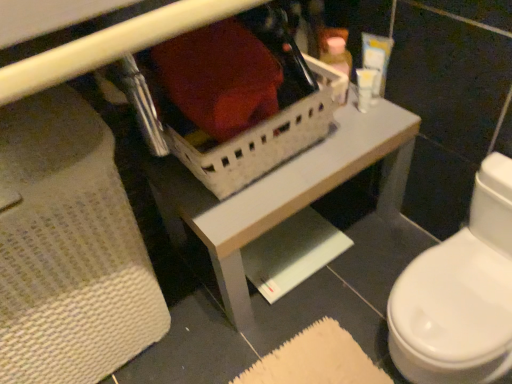
You are a GUI agent. You are given a task and a screenshot of the screen. Output one action in this format:
    pyautogui.click(x=<x>, y=<y>)
    Task: Click on the white plastic container at upper right, the 2th toiletry when ordered from right to left
    
    Given the screenshot: What is the action you would take?
    pyautogui.click(x=365, y=88)

At what (x,y) coordinates should I click in order to perform the action: click on white plastic container at upper center, marked as the 1th toiletry in a left-to-right arrangement. Please return your answer as a coordinate pair (x, y). The width and height of the screenshot is (512, 384). Looking at the image, I should click on (337, 55).

From the image's perspective, does white plastic container at upper right, the 2th toiletry when ordered from right to left, appear lower than white plastic basket at center?

No.

Is white plastic container at upper right, the 2th toiletry when ordered from right to left, thinner than white plastic basket at center?

Yes, white plastic container at upper right, the 2th toiletry when ordered from right to left, is thinner than white plastic basket at center.

Considering the sizes of objects white plastic container at upper right, the 2th toiletry when ordered from right to left, and white plastic basket at center in the image provided, who is bigger, white plastic container at upper right, the 2th toiletry when ordered from right to left, or white plastic basket at center?

white plastic basket at center.

You are a GUI agent. You are given a task and a screenshot of the screen. Output one action in this format:
    pyautogui.click(x=<x>, y=<y>)
    Task: Click on the toiletry that is the 1st object located behind the white plastic basket at center
    
    Given the screenshot: What is the action you would take?
    pyautogui.click(x=377, y=58)

Is the depth of white plastic container at upper right, placed as the 1th toiletry when sorted from right to left, greater than that of white plastic basket at center?

Yes, it is.

Are white plastic container at upper right, placed as the 1th toiletry when sorted from right to left, and white plastic basket at center beside each other?

There is a gap between white plastic container at upper right, placed as the 1th toiletry when sorted from right to left, and white plastic basket at center.

From the image's perspective, is white plastic basket at center beneath white plastic container at upper right, placed as the 1th toiletry when sorted from right to left?

Indeed, from the image's perspective, white plastic basket at center is shown beneath white plastic container at upper right, placed as the 1th toiletry when sorted from right to left.

How many degrees apart are the facing directions of white plastic basket at center and white plastic container at upper right, placed as the 1th toiletry when sorted from right to left?

There is a 49.9-degree angle between the facing directions of white plastic basket at center and white plastic container at upper right, placed as the 1th toiletry when sorted from right to left.

In terms of width, does white plastic basket at center look wider or thinner when compared to white plastic container at upper right, marked as the third toiletry in a left-to-right arrangement?

In the image, white plastic basket at center appears to be wider than white plastic container at upper right, marked as the third toiletry in a left-to-right arrangement.

At what (x,y) coordinates should I click in order to perform the action: click on toiletry that is the 3rd one when counting upward from the white plastic basket at center (from the image's perspective). Please return your answer as a coordinate pair (x, y). The height and width of the screenshot is (384, 512). Looking at the image, I should click on (377, 58).

Considering the sizes of objects white plastic container at upper right, placed as the 2th toiletry when sorted from left to right, and white plastic container at upper center, marked as the 1th toiletry in a left-to-right arrangement, in the image provided, who is bigger, white plastic container at upper right, placed as the 2th toiletry when sorted from left to right, or white plastic container at upper center, marked as the 1th toiletry in a left-to-right arrangement,?

Bigger between the two is white plastic container at upper center, marked as the 1th toiletry in a left-to-right arrangement.

Is white plastic container at upper right, the 2th toiletry when ordered from right to left, next to white plastic container at upper center, positioned as the 3th toiletry in right-to-left order, and touching it?

Yes, white plastic container at upper right, the 2th toiletry when ordered from right to left, is next to white plastic container at upper center, positioned as the 3th toiletry in right-to-left order.

Find the location of a particular element. toiletry on the left of white plastic container at upper right, placed as the 2th toiletry when sorted from left to right is located at coordinates (337, 55).

From the image's perspective, is white plastic container at upper right, placed as the 2th toiletry when sorted from left to right, beneath white plastic container at upper center, positioned as the 3th toiletry in right-to-left order?

Indeed, from the image's perspective, white plastic container at upper right, placed as the 2th toiletry when sorted from left to right, is shown beneath white plastic container at upper center, positioned as the 3th toiletry in right-to-left order.

From the image's perspective, does white plastic container at upper center, positioned as the 3th toiletry in right-to-left order, appear higher than white plastic container at upper right, the 2th toiletry when ordered from right to left?

Yes, from the image's perspective, white plastic container at upper center, positioned as the 3th toiletry in right-to-left order, is over white plastic container at upper right, the 2th toiletry when ordered from right to left.

Is white plastic container at upper center, marked as the 1th toiletry in a left-to-right arrangement, next to white plastic container at upper right, placed as the 2th toiletry when sorted from left to right, and touching it?

Yes, white plastic container at upper center, marked as the 1th toiletry in a left-to-right arrangement, is touching white plastic container at upper right, placed as the 2th toiletry when sorted from left to right.

Is white plastic container at upper right, placed as the 2th toiletry when sorted from left to right, surrounded by white plastic container at upper center, positioned as the 3th toiletry in right-to-left order?

No, white plastic container at upper center, positioned as the 3th toiletry in right-to-left order, does not contain white plastic container at upper right, placed as the 2th toiletry when sorted from left to right.

Does point (333, 58) lie behind point (366, 97)?

Yes, it is behind point (366, 97).

Is white plastic container at upper right, the 2th toiletry when ordered from right to left, placed right next to white plastic basket at center?

white plastic container at upper right, the 2th toiletry when ordered from right to left, and white plastic basket at center are not in contact.

From the image's perspective, which toiletry is the 1st one above the white plastic basket at center? Please provide its 2D coordinates.

[(365, 88)]

How many degrees apart are the facing directions of white plastic container at upper right, placed as the 2th toiletry when sorted from left to right, and white plastic basket at center?

47.9 degrees.

From a real-world perspective, who is located lower, white plastic container at upper right, placed as the 2th toiletry when sorted from left to right, or white plastic basket at center?

From a 3D spatial view, white plastic container at upper right, placed as the 2th toiletry when sorted from left to right, is below.

Does white plastic basket at center come in front of white plastic basket at center?

Yes.

Is white plastic basket at center bigger than white plastic basket at center?

No.

Is white plastic basket at center far from white plastic basket at center?

white plastic basket at center is actually quite close to white plastic basket at center.

Is point (157, 82) closer to camera compared to point (354, 97)?

Yes, point (157, 82) is in front of point (354, 97).

From a real-world perspective, count 1st toiletrys upward from the white plastic basket at center and point to it. Please provide its 2D coordinates.

[(365, 88)]

You are a GUI agent. You are given a task and a screenshot of the screen. Output one action in this format:
    pyautogui.click(x=<x>, y=<y>)
    Task: Click on the 3rd toiletry positioned above the white plastic basket at center (from the image's perspective)
    This screenshot has height=384, width=512.
    Given the screenshot: What is the action you would take?
    pyautogui.click(x=377, y=58)

Based on their spatial positions, is white plastic container at upper right, placed as the 2th toiletry when sorted from left to right, or white plastic basket at center closer to white plastic container at upper center, marked as the 1th toiletry in a left-to-right arrangement?

Among the two, white plastic container at upper right, placed as the 2th toiletry when sorted from left to right, is located nearer to white plastic container at upper center, marked as the 1th toiletry in a left-to-right arrangement.

Based on their spatial positions, is white plastic container at upper right, placed as the 1th toiletry when sorted from right to left, or white plastic container at upper right, placed as the 2th toiletry when sorted from left to right, further from white plastic basket at center?

Among the two, white plastic container at upper right, placed as the 1th toiletry when sorted from right to left, is located further to white plastic basket at center.

Based on their spatial positions, is white plastic container at upper right, placed as the 1th toiletry when sorted from right to left, or white plastic basket at center further from white plastic container at upper center, marked as the 1th toiletry in a left-to-right arrangement?

Based on the image, white plastic basket at center appears to be further to white plastic container at upper center, marked as the 1th toiletry in a left-to-right arrangement.

Looking at the image, which one is located further to white plastic container at upper right, the 2th toiletry when ordered from right to left, white plastic container at upper right, placed as the 1th toiletry when sorted from right to left, or white plastic basket at center?

The object further to white plastic container at upper right, the 2th toiletry when ordered from right to left, is white plastic basket at center.

Considering their positions, is white plastic basket at center positioned closer to white plastic container at upper center, marked as the 1th toiletry in a left-to-right arrangement, than white plastic basket at center?

white plastic basket at center lies closer to white plastic container at upper center, marked as the 1th toiletry in a left-to-right arrangement, than the other object.

From the image, which object appears to be nearer to white plastic basket at center, white plastic container at upper right, the 2th toiletry when ordered from right to left, or white plastic basket at center?

The object closer to white plastic basket at center is white plastic basket at center.

From the image, which object appears to be farther from white plastic container at upper right, placed as the 1th toiletry when sorted from right to left, white plastic container at upper right, the 2th toiletry when ordered from right to left, or white plastic basket at center?

white plastic basket at center is positioned further to the anchor white plastic container at upper right, placed as the 1th toiletry when sorted from right to left.

Which object lies further to the anchor point white plastic container at upper right, marked as the third toiletry in a left-to-right arrangement, white plastic basket at center or white plastic basket at center?

Based on the image, white plastic basket at center appears to be further to white plastic container at upper right, marked as the third toiletry in a left-to-right arrangement.

The width and height of the screenshot is (512, 384). I want to click on toiletry between white plastic container at upper center, positioned as the 3th toiletry in right-to-left order, and white plastic basket at center from top to bottom, so click(365, 88).

This screenshot has height=384, width=512. What are the coordinates of `table between white plastic basket at center and white plastic container at upper right, placed as the 1th toiletry when sorted from right to left` in the screenshot? It's located at (283, 192).

Locate an element on the screen. The width and height of the screenshot is (512, 384). toiletry located between white plastic container at upper center, positioned as the 3th toiletry in right-to-left order, and white plastic container at upper right, marked as the third toiletry in a left-to-right arrangement, in the left-right direction is located at coordinates (365, 88).

Find the location of a particular element. This screenshot has height=384, width=512. table between white plastic basket at center and white plastic container at upper right, placed as the 2th toiletry when sorted from left to right, from left to right is located at coordinates (283, 192).